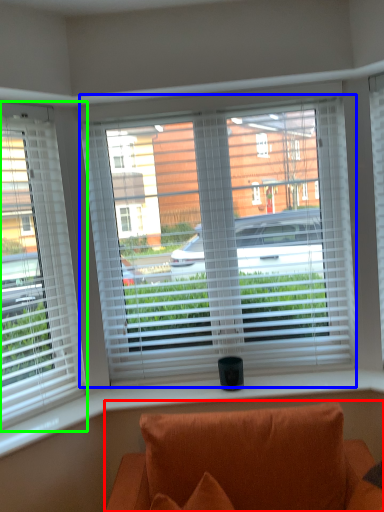
Question: Considering the real-world distances, which object is closest to studio couch (highlighted by a red box)? window (highlighted by a blue box) or window (highlighted by a green box).

Choices:
 (A) window
 (B) window

Answer: (A)